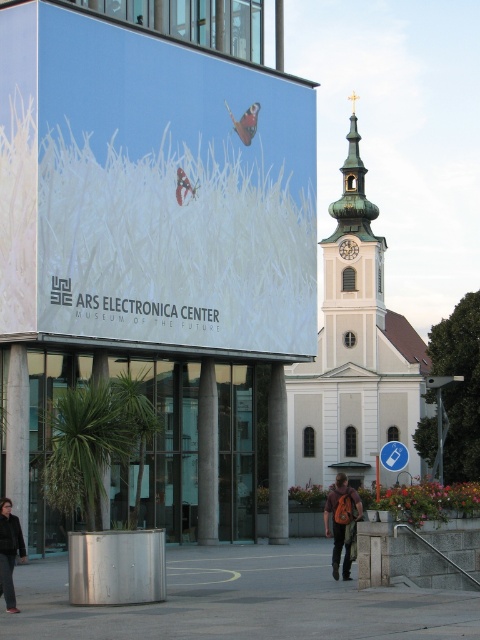
You are a drone operator trying to land a drone on the grassy area in the image. The drone has a GPS coordinate system where the bottom left corner is the origin point. The grass is located at a specific coordinate. Can you confirm if the matte white grass at upper left is positioned at the coordinate point of approximately 0.298 on the x and 0.317 on the y axis?

Yes, the matte white grass at upper left is positioned at the coordinate point of approximately 0.298 on the x and 0.317 on the y axis.

You are an architect analyzing the image. You need to determine which object, the matte white grass at upper left or the white concrete pillar at center, is taller. Based on the scene, which one is taller?

The matte white grass at upper left is much taller than the white concrete pillar at center according to the description.